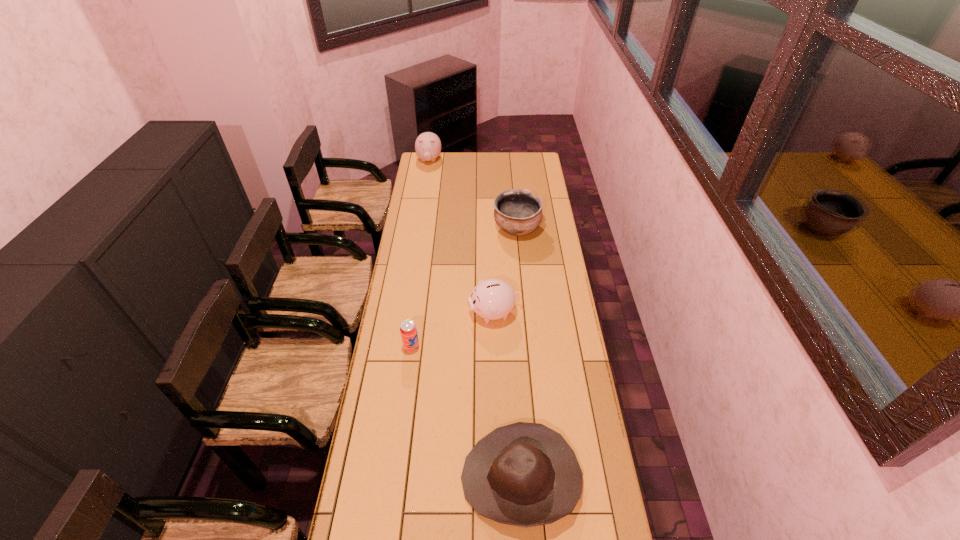
Identify the location of vacant space at the right edge of the desktop. (549, 225).

Where is `vacant area between the nearer piggy bank and the nearest object`? Image resolution: width=960 pixels, height=540 pixels. vacant area between the nearer piggy bank and the nearest object is located at coordinates (508, 396).

The image size is (960, 540). Identify the location of vacant point located between the farther piggy bank and the second farthest object. (473, 195).

The width and height of the screenshot is (960, 540). In order to click on blank region between the second nearest object and the pottery in this screenshot , I will do `click(464, 288)`.

Image resolution: width=960 pixels, height=540 pixels. I want to click on empty location between the nearest object and the right piggy bank, so click(508, 396).

Find the location of a particular element. Image resolution: width=960 pixels, height=540 pixels. free spot between the soda can and the pottery is located at coordinates (464, 288).

Where is `free spot between the left piggy bank and the second farthest object`? This screenshot has height=540, width=960. free spot between the left piggy bank and the second farthest object is located at coordinates (473, 195).

Image resolution: width=960 pixels, height=540 pixels. What are the coordinates of `unoccupied position between the farther piggy bank and the fourth farthest object` in the screenshot? It's located at (420, 254).

Where is `free space between the soda can and the third farthest object`? free space between the soda can and the third farthest object is located at coordinates (453, 330).

You are a GUI agent. You are given a task and a screenshot of the screen. Output one action in this format:
    pyautogui.click(x=<x>, y=<y>)
    Task: Click on the blank region between the nearer piggy bank and the fourth nearest object
    
    Given the screenshot: What is the action you would take?
    pyautogui.click(x=505, y=271)